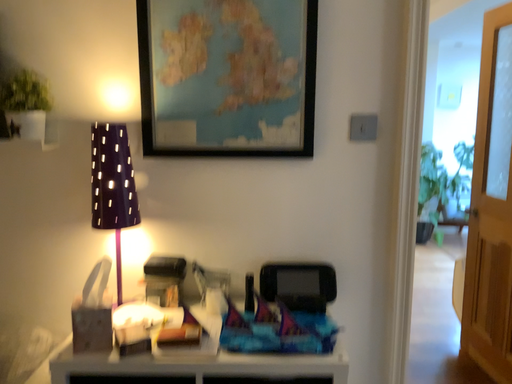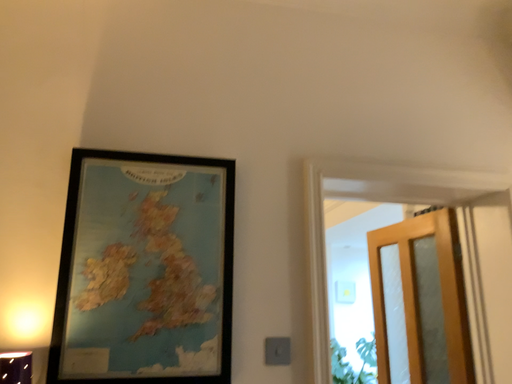
Question: Which way did the camera rotate in the video?

Choices:
 (A) rotated left
 (B) rotated right

Answer: (B)